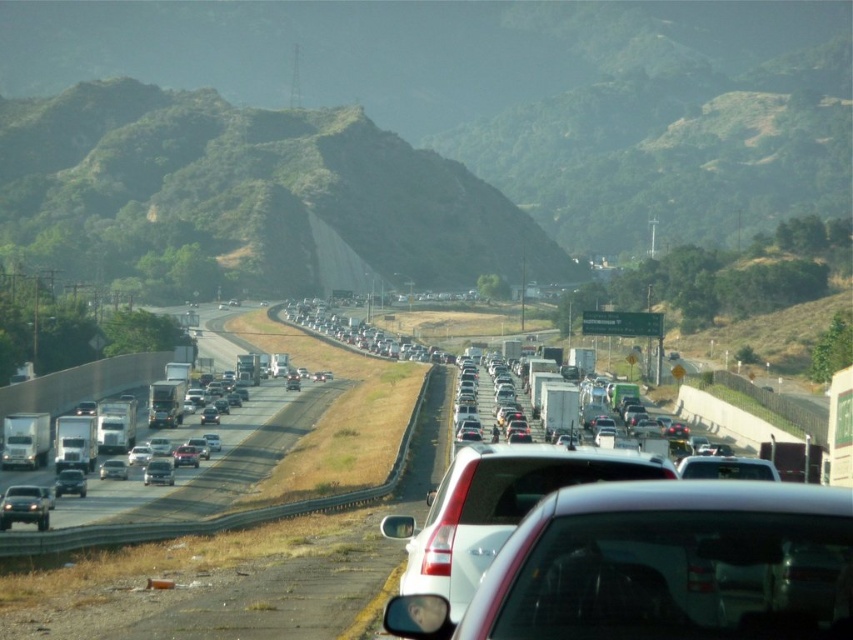
Is point (18, 461) positioned in front of point (103, 472)?

No, it is not.

Where is `metallic silver truck at left`? The height and width of the screenshot is (640, 853). metallic silver truck at left is located at coordinates (25, 440).

Is white glossy sedan at center above silver metallic sedan at center?

Indeed, white glossy sedan at center is positioned over silver metallic sedan at center.

Does white glossy sedan at center lie behind silver metallic sedan at center?

No.

Identify the location of white glossy sedan at center. The width and height of the screenshot is (853, 640). (496, 508).

Consider the image. Between white glossy sedan at center and metallic silver truck at left, which one is positioned higher?

white glossy sedan at center is higher up.

Who is shorter, white glossy sedan at center or metallic silver truck at left?

metallic silver truck at left

At what (x,y) coordinates should I click in order to perform the action: click on white glossy sedan at center. Please return your answer as a coordinate pair (x, y). Looking at the image, I should click on (496, 508).